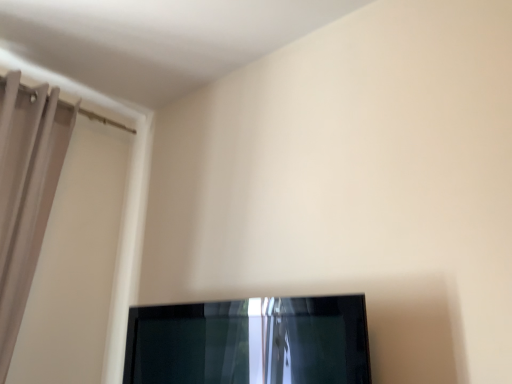
Locate an element on the screen. This screenshot has width=512, height=384. black glossy tv at center is located at coordinates [250, 342].

The image size is (512, 384). What do you see at coordinates (250, 342) in the screenshot?
I see `black glossy tv at center` at bounding box center [250, 342].

You are a GUI agent. You are given a task and a screenshot of the screen. Output one action in this format:
    pyautogui.click(x=<x>, y=<y>)
    Task: Click on the black glossy tv at center
    The image size is (512, 384).
    Given the screenshot: What is the action you would take?
    pyautogui.click(x=250, y=342)